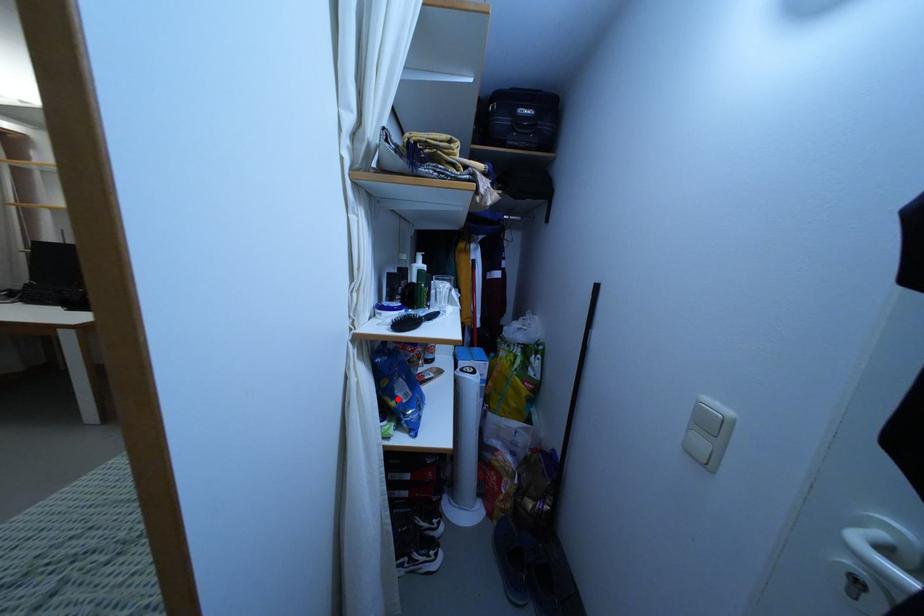
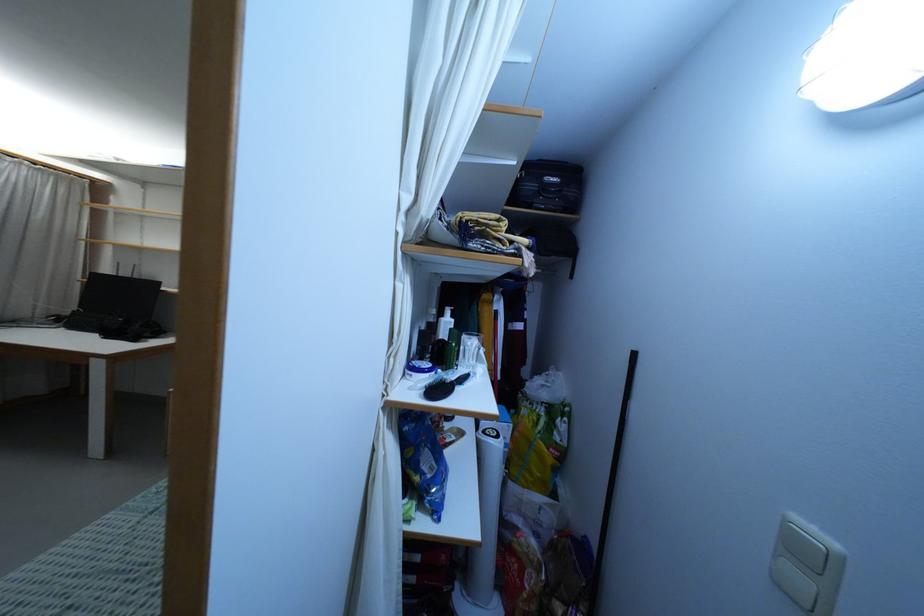
Find the pixel in the second image that matches the highlighted location in the first image.

(422, 474)